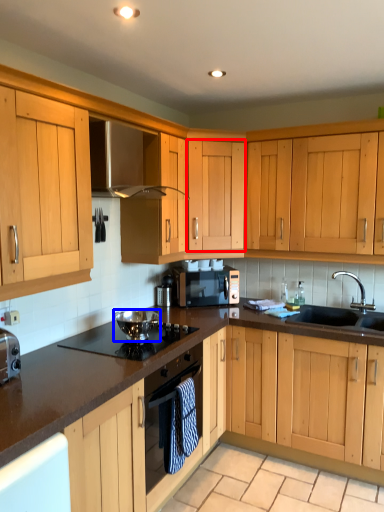
Question: Among these objects, which one is farthest to the camera, cabinetry (highlighted by a red box) or appliance (highlighted by a blue box)?

Choices:
 (A) cabinetry
 (B) appliance

Answer: (A)